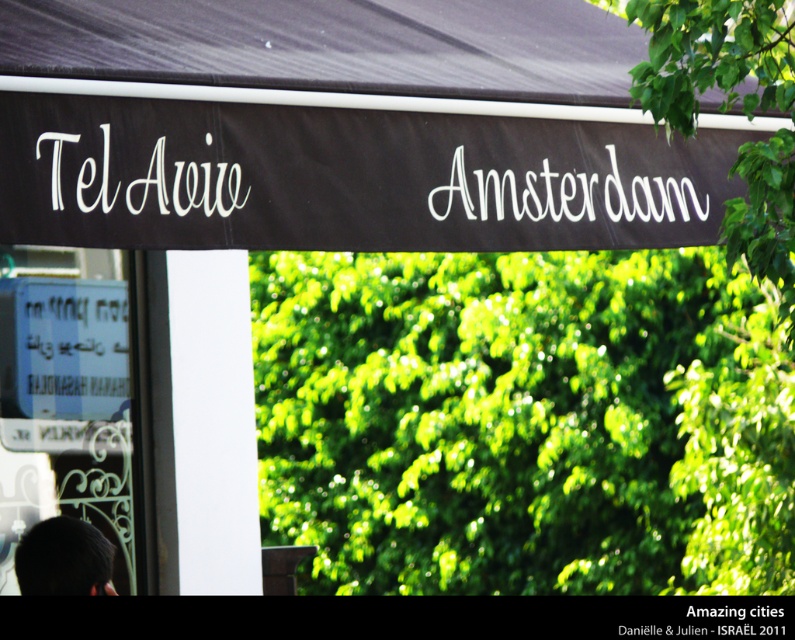
You are standing in front of the canopy tent and want to take a photo. There are two points marked on the banner, one at coordinates point (103, 179) and the other at point (64, 582). Which point will appear larger in your photo?

Point (103, 179) is closer to the camera than point (64, 582). Since objects closer to the camera appear larger in a photo, the point at (103, 179) will appear larger in the photo.

You are a photographer setting up a shot in this scene. You need to position a 2.5 feet wide lighting panel between the black fabric canopy at upper center and the black hair at lower left. Is there enough space to place it without moving either object?

The distance between the black fabric canopy at upper center and the black hair at lower left is 3.46 feet. Since the lighting panel is 2.5 feet wide, there is sufficient space to place it between them without moving either object.